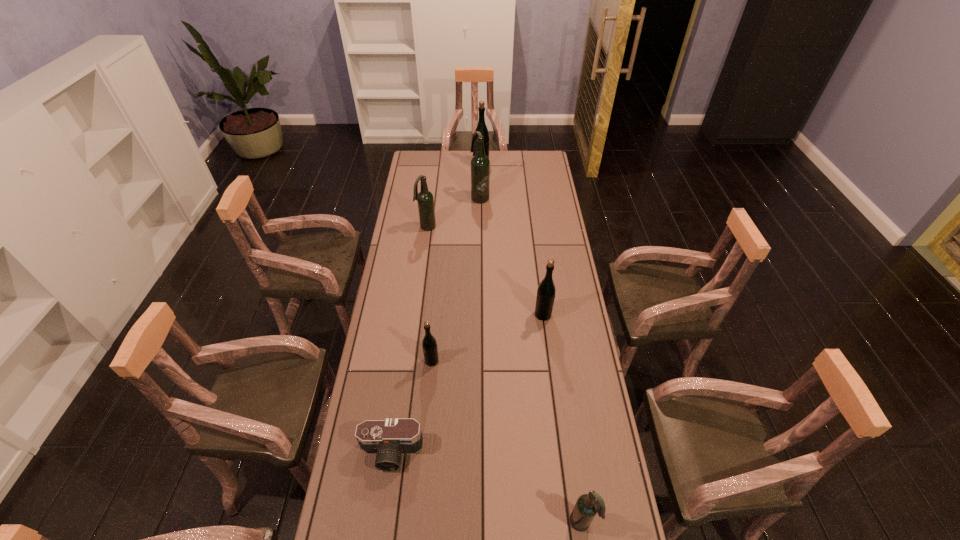
You are a GUI agent. You are given a task and a screenshot of the screen. Output one action in this format:
    pyautogui.click(x=<x>, y=<y>)
    Task: Click on the free area in between the shortest object and the second green beer bottle from right to left
    
    Given the screenshot: What is the action you would take?
    pyautogui.click(x=437, y=309)

Where is `free point between the second nearest object and the smallest dark beer bottle`? free point between the second nearest object and the smallest dark beer bottle is located at coordinates 487,488.

This screenshot has width=960, height=540. I want to click on vacant area that lies between the second nearest beer bottle and the shortest object, so pos(412,407).

The image size is (960, 540). In order to click on blank region between the farthest green beer bottle and the second biggest dark beer bottle in this screenshot , I will do `click(454, 196)`.

The width and height of the screenshot is (960, 540). What are the coordinates of `blank region between the biggest green beer bottle and the camera` in the screenshot? It's located at (437, 309).

Where is `unoccupied area between the nearest beer bottle and the farthest object`? unoccupied area between the nearest beer bottle and the farthest object is located at coordinates (532, 343).

The width and height of the screenshot is (960, 540). In order to click on free spot between the second green beer bottle from left to right and the nearest object in this screenshot , I will do `click(532, 343)`.

Identify which object is the fourth nearest to the second farthest green beer bottle. Please provide its 2D coordinates. Your answer should be formatted as a tuple, i.e. [(x, y)], where the tuple contains the x and y coordinates of a point satisfying the conditions above.

[(586, 507)]

Where is `object that stands as the second closest to the farthest dark beer bottle`? This screenshot has width=960, height=540. object that stands as the second closest to the farthest dark beer bottle is located at coordinates (425, 200).

Identify which beer bottle is the fourth nearest to the smallest green beer bottle. Please provide its 2D coordinates. Your answer should be formatted as a tuple, i.e. [(x, y)], where the tuple contains the x and y coordinates of a point satisfying the conditions above.

[(480, 165)]